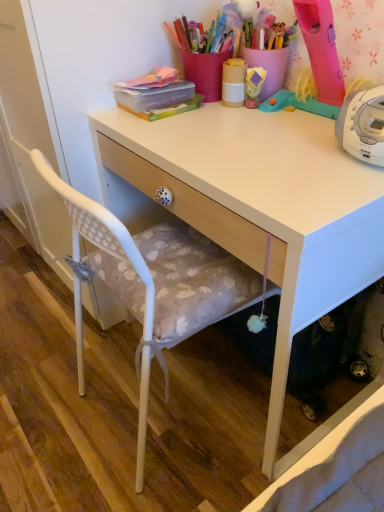
Locate an element on the screen. The image size is (384, 512). vacant space underneath white plastic chair at left (from a real-world perspective) is located at coordinates (155, 418).